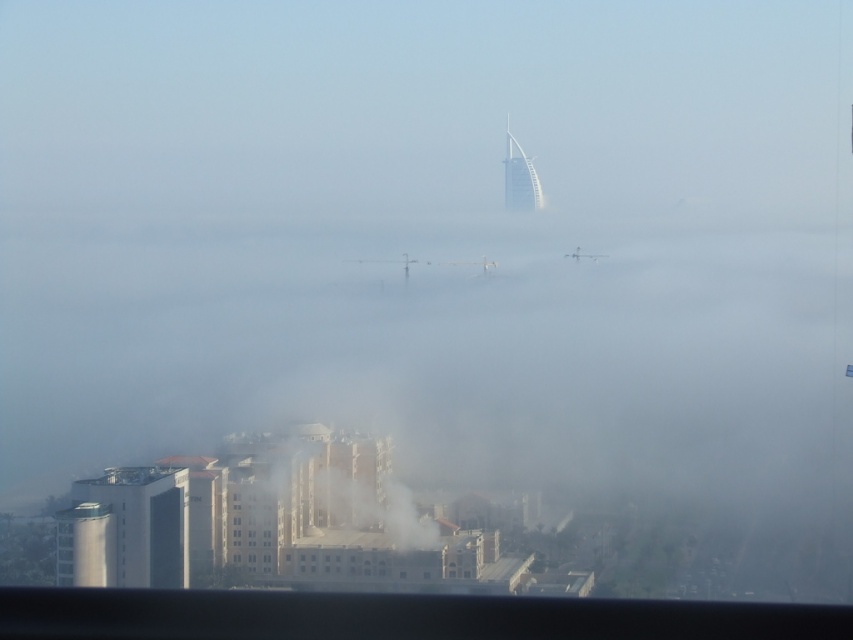
Question: Which object is closer to the camera taking this photo?

Choices:
 (A) white glass tower at upper center
 (B) white smoke at center

Answer: (B)

Question: Which of the following is the farthest from the observer?

Choices:
 (A) (511, 138)
 (B) (383, 529)

Answer: (A)

Question: Is white smoke at center thinner than white glass tower at upper center?

Choices:
 (A) no
 (B) yes

Answer: (A)

Question: Does white smoke at center have a lesser width compared to white glass tower at upper center?

Choices:
 (A) yes
 (B) no

Answer: (B)

Question: Does white smoke at center have a lesser width compared to white glass tower at upper center?

Choices:
 (A) yes
 (B) no

Answer: (B)

Question: Which of the following is the farthest from the observer?

Choices:
 (A) (378, 512)
 (B) (518, 192)

Answer: (A)